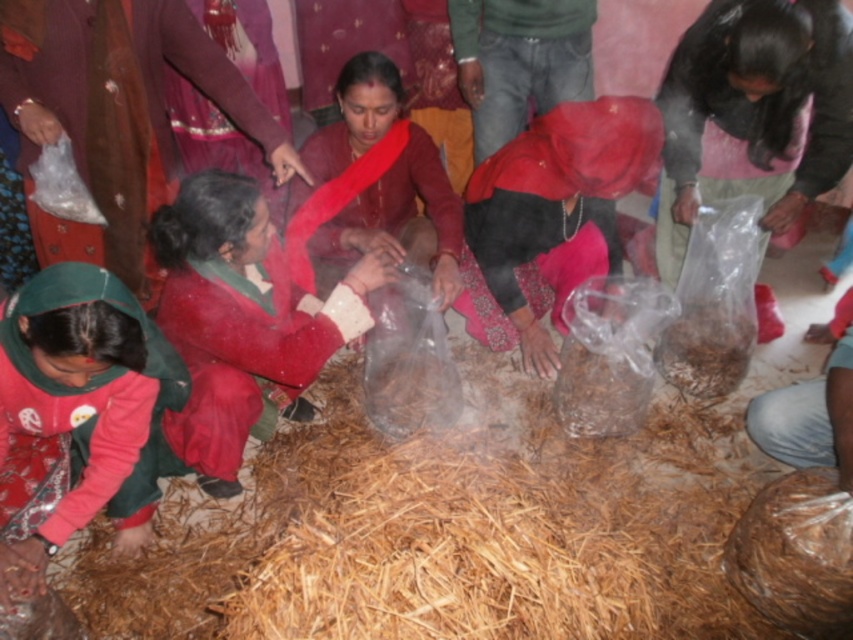
Which is more to the left, matte red saree at lower left or green fabric cap at lower left?

From the viewer's perspective, matte red saree at lower left appears more on the left side.

Between matte red saree at lower left and green fabric cap at lower left, which one has more height?

With more height is matte red saree at lower left.

What are the coordinates of `matte red saree at lower left` in the screenshot? It's located at (115, 115).